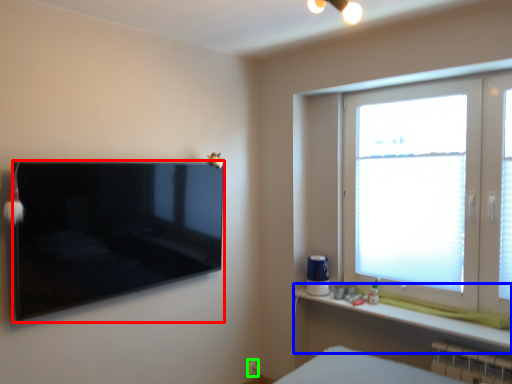
Question: Which is farther away from television (highlighted by a red box)? window sill (highlighted by a blue box) or electric outlet (highlighted by a green box)?

Choices:
 (A) window sill
 (B) electric outlet

Answer: (B)